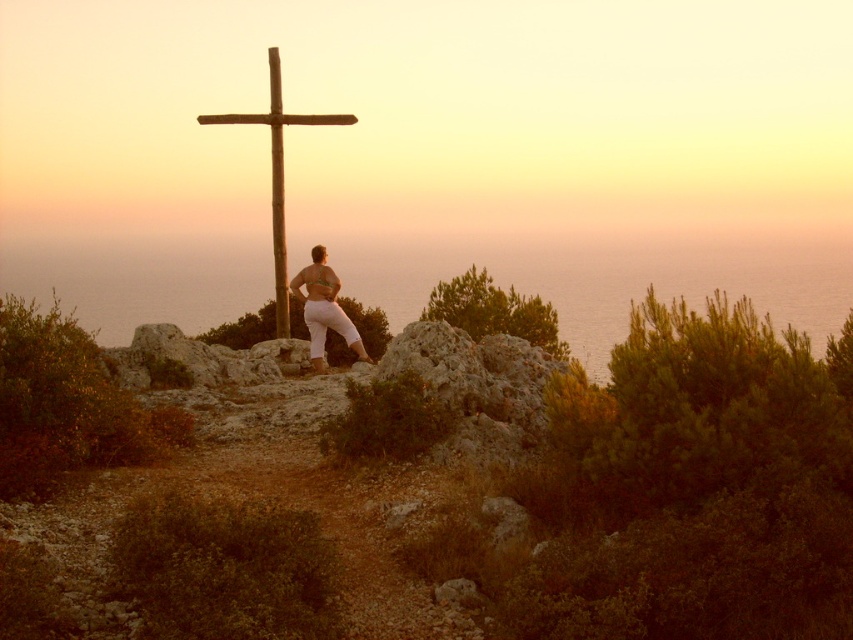
Question: Can you confirm if wooden cross at center is wider than matte white pants at center?

Choices:
 (A) yes
 (B) no

Answer: (A)

Question: Among these points, which one is farthest from the camera?

Choices:
 (A) (358, 356)
 (B) (277, 289)

Answer: (B)

Question: Can you confirm if wooden cross at center is thinner than matte white pants at center?

Choices:
 (A) no
 (B) yes

Answer: (A)

Question: Among these objects, which one is nearest to the camera?

Choices:
 (A) wooden cross at center
 (B) matte white pants at center

Answer: (B)

Question: Is wooden cross at center smaller than matte white pants at center?

Choices:
 (A) yes
 (B) no

Answer: (B)